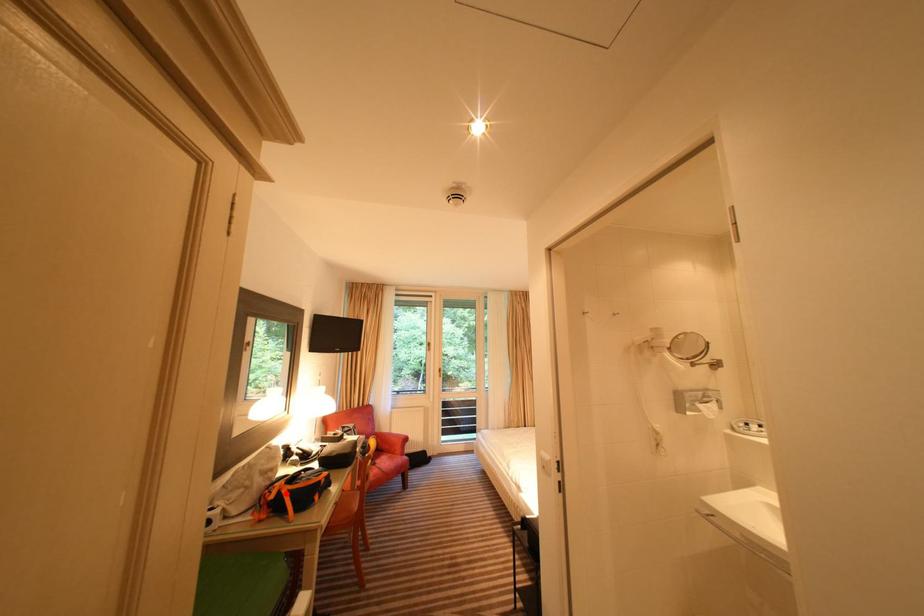
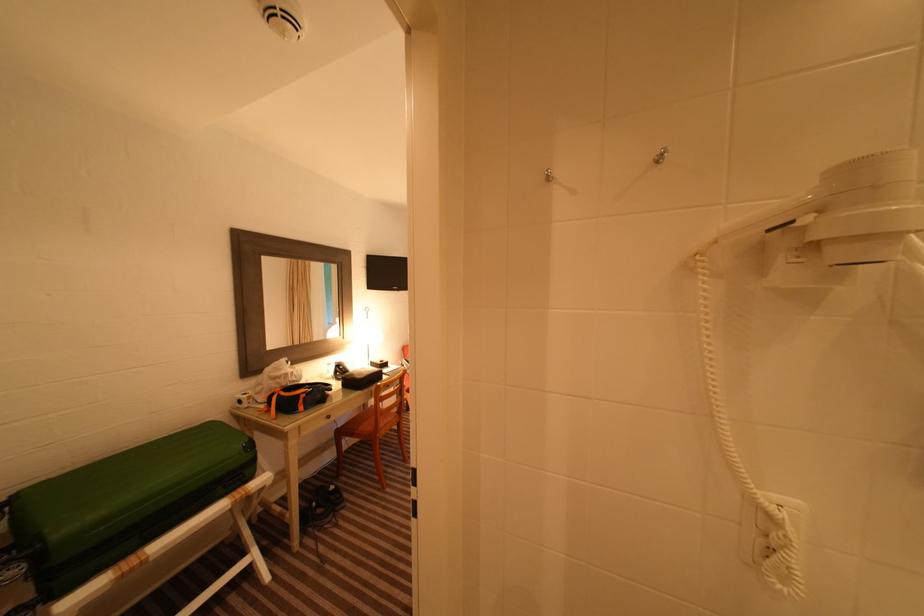
Where in the second image is the point corresponding to the highlighted location from the first image?

(280, 397)